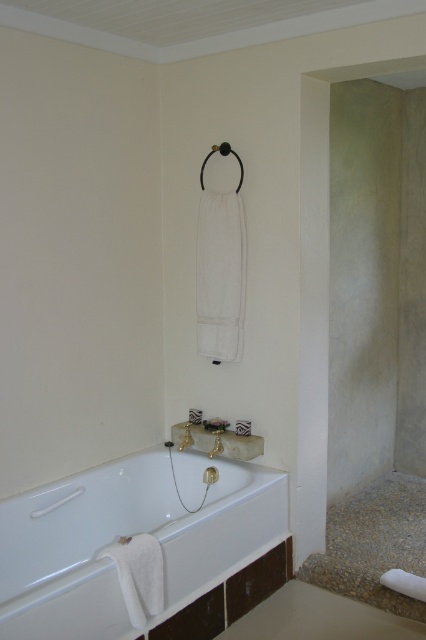
Who is more forward, (247, 548) or (396, 582)?

Point (396, 582) is more forward.

Locate an element on the screen. The width and height of the screenshot is (426, 640). white glossy bathtub at lower left is located at coordinates coord(126,532).